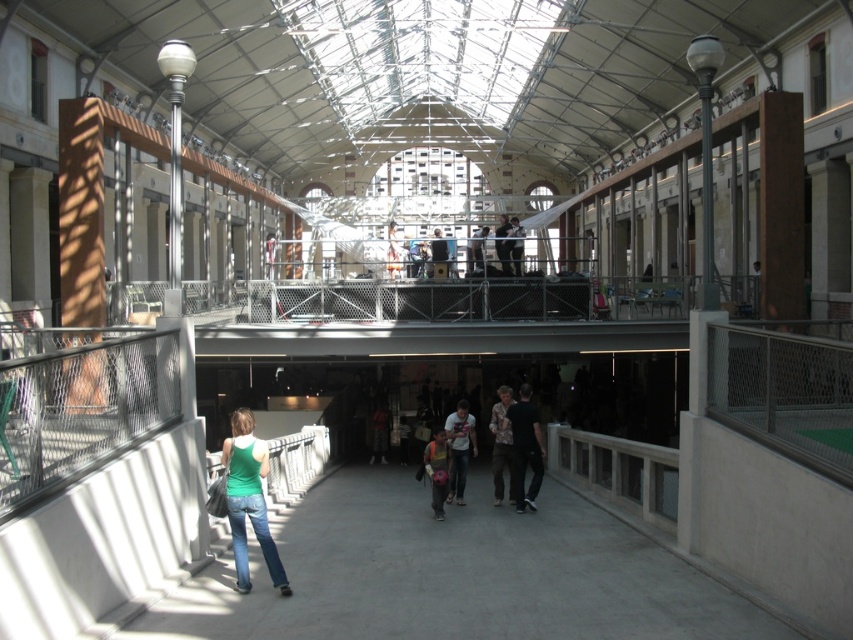
Question: Is dark gray fabric at upper center thinner than dark blue jeans at center?

Choices:
 (A) yes
 (B) no

Answer: (A)

Question: Which object appears closest to the camera in this image?

Choices:
 (A) green matte shirt at lower center
 (B) dark brown leather jacket at center
 (C) floral-patterned shirt at center
 (D) light brown leather jacket at center

Answer: (A)

Question: Can you confirm if green matte shirt at lower center is positioned to the left of matte gray backpack at center?

Choices:
 (A) no
 (B) yes

Answer: (B)

Question: Which of the following is the closest to the observer?

Choices:
 (A) dark gray shirt at center
 (B) light brown leather jacket at center
 (C) dark blue jeans at center

Answer: (A)

Question: Which point is farther to the camera?

Choices:
 (A) (447, 445)
 (B) (456, 456)

Answer: (B)

Question: Is light brown leather jacket at center positioned in front of matte black jacket at center?

Choices:
 (A) no
 (B) yes

Answer: (B)